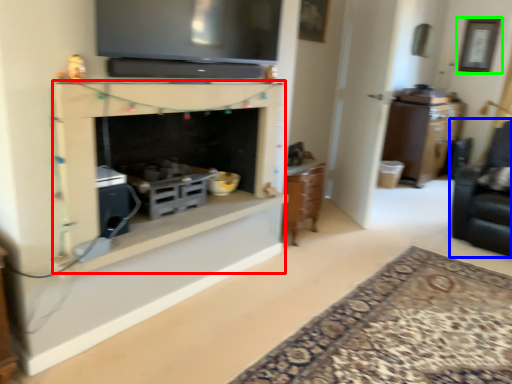
Question: Which object is the farthest from fireplace (highlighted by a red box)? Choose among these: swivel chair (highlighted by a blue box) or picture frame (highlighted by a green box).

Choices:
 (A) swivel chair
 (B) picture frame

Answer: (B)